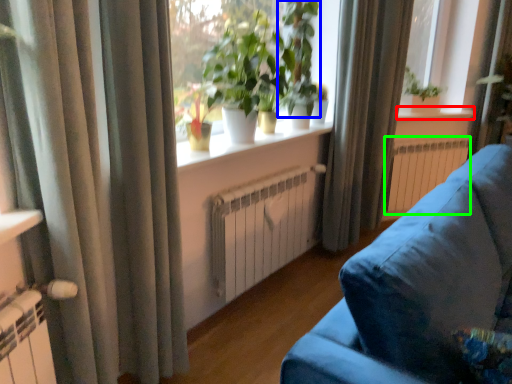
Question: Considering the real-world distances, which object is closest to window sill (highlighted by a red box)? vegetation (highlighted by a blue box) or radiator (highlighted by a green box).

Choices:
 (A) vegetation
 (B) radiator

Answer: (B)